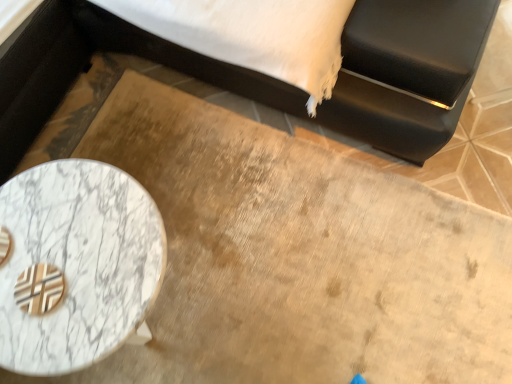
Question: Is black leather bed at upper left positioned far away from marble table at lower left?

Choices:
 (A) yes
 (B) no

Answer: (B)

Question: Is marble table at lower left a part of black leather bed at upper left?

Choices:
 (A) yes
 (B) no

Answer: (B)

Question: Considering the relative sizes of black leather bed at upper left and marble table at lower left in the image provided, is black leather bed at upper left smaller than marble table at lower left?

Choices:
 (A) yes
 (B) no

Answer: (B)

Question: Is black leather bed at upper left not inside marble table at lower left?

Choices:
 (A) yes
 (B) no

Answer: (A)

Question: From the image's perspective, is black leather bed at upper left located above marble table at lower left?

Choices:
 (A) yes
 (B) no

Answer: (A)

Question: From a real-world perspective, is black leather bed at upper left on marble table at lower left?

Choices:
 (A) no
 (B) yes

Answer: (B)

Question: Can you confirm if marble table at lower left is positioned to the right of black leather bed at upper left?

Choices:
 (A) no
 (B) yes

Answer: (A)

Question: Could you tell me if marble table at lower left is turned towards black leather bed at upper left?

Choices:
 (A) yes
 (B) no

Answer: (B)

Question: Can you confirm if marble table at lower left is thinner than black leather bed at upper left?

Choices:
 (A) no
 (B) yes

Answer: (B)

Question: Can black leather bed at upper left be found inside marble table at lower left?

Choices:
 (A) yes
 (B) no

Answer: (B)

Question: From a real-world perspective, does marble table at lower left sit lower than black leather bed at upper left?

Choices:
 (A) no
 (B) yes

Answer: (B)

Question: Considering the relative positions of marble table at lower left and black leather bed at upper left in the image provided, is marble table at lower left behind black leather bed at upper left?

Choices:
 (A) no
 (B) yes

Answer: (B)

Question: Relative to black leather bed at upper left, is marble table at lower left in front or behind?

Choices:
 (A) behind
 (B) front

Answer: (A)